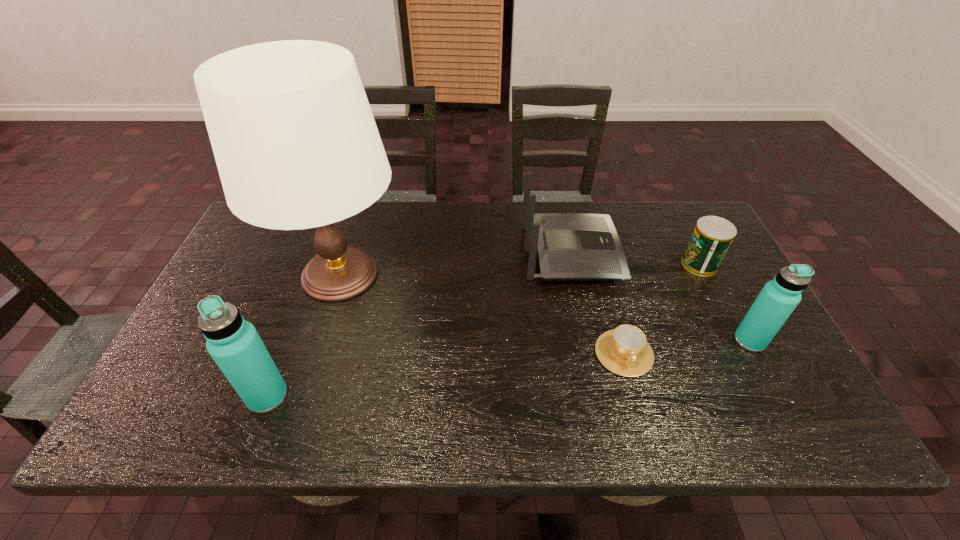
The image size is (960, 540). I want to click on free space that satisfies the following two spatial constraints: 1. on the back side of the lamp; 2. on the front-facing side of the third shortest object, so click(x=348, y=253).

Where is `free point that satisfies the following two spatial constraints: 1. on the front side of the farther water bottle; 2. on the right side of the can`? The image size is (960, 540). free point that satisfies the following two spatial constraints: 1. on the front side of the farther water bottle; 2. on the right side of the can is located at coordinates (738, 341).